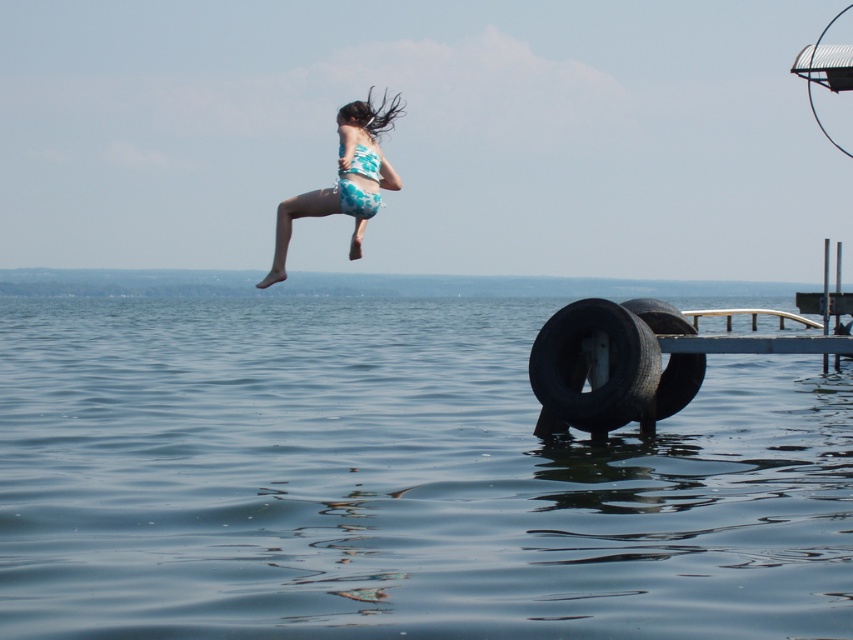
You are standing at the edge of the water and see two points in the scene. Which point is closer to you, point (776, 573) or point (657, 390)?

Point (776, 573) is in front of point (657, 390), so it is closer to you.

You are a swimmer preparing to jump into the transparent blue water at lower center. There is a black rubber tire at lower right. Where should you aim to land safely?

You should aim for the transparent blue water at lower center because it is positioned over the black rubber tire at lower right, meaning the water is above the tire and a safer landing spot.